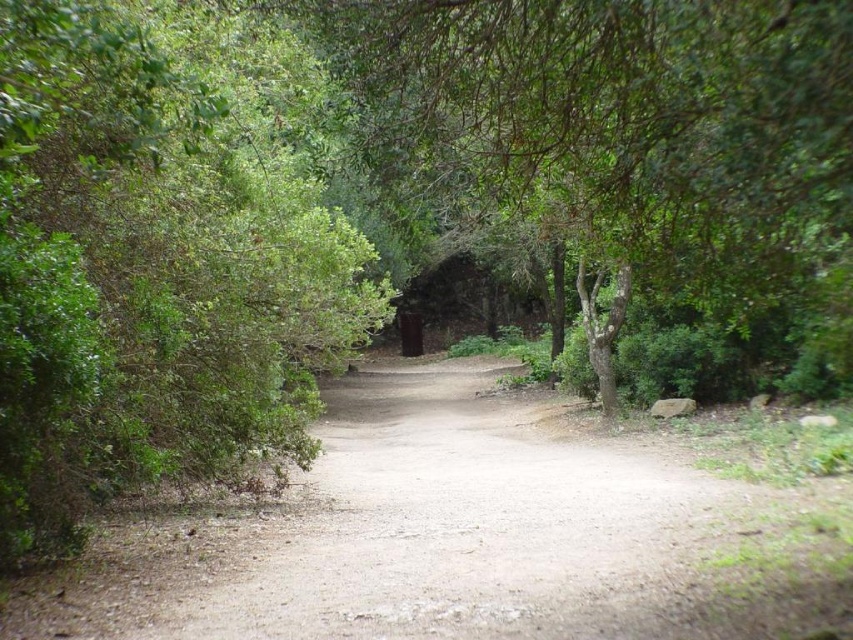
Is green leafy bush at left shorter than dirt path at center?

No, green leafy bush at left is not shorter than dirt path at center.

The image size is (853, 640). What do you see at coordinates (160, 257) in the screenshot?
I see `green leafy bush at left` at bounding box center [160, 257].

The image size is (853, 640). In order to click on green leafy bush at left in this screenshot , I will do `click(160, 257)`.